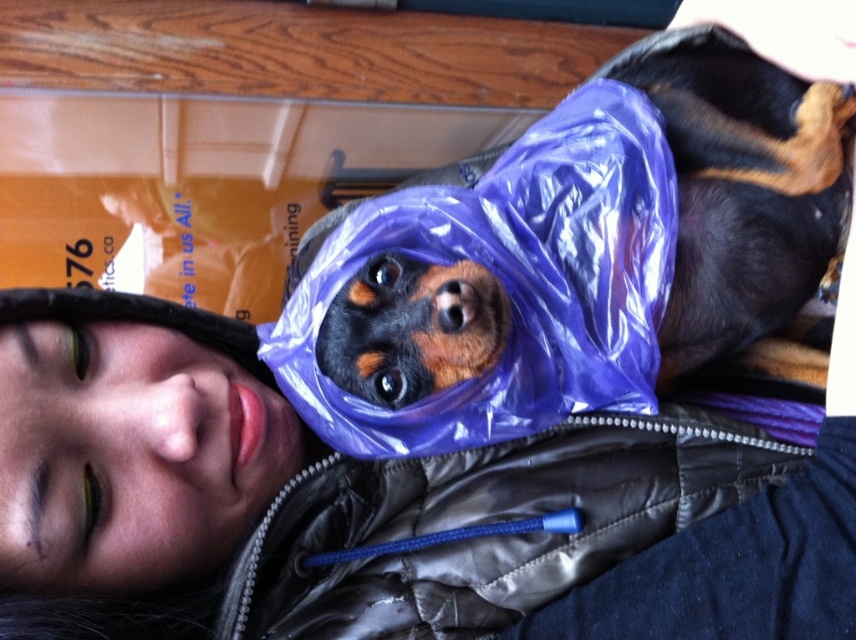
Which is more to the right, matte black jacket at upper left or shiny purple plastic bag at center?

shiny purple plastic bag at center is more to the right.

Who is shorter, matte black jacket at upper left or shiny purple plastic bag at center?

With less height is matte black jacket at upper left.

Which is behind, point (78, 356) or point (400, 250)?

Point (78, 356)

Locate an element on the screen. matte black jacket at upper left is located at coordinates (367, 502).